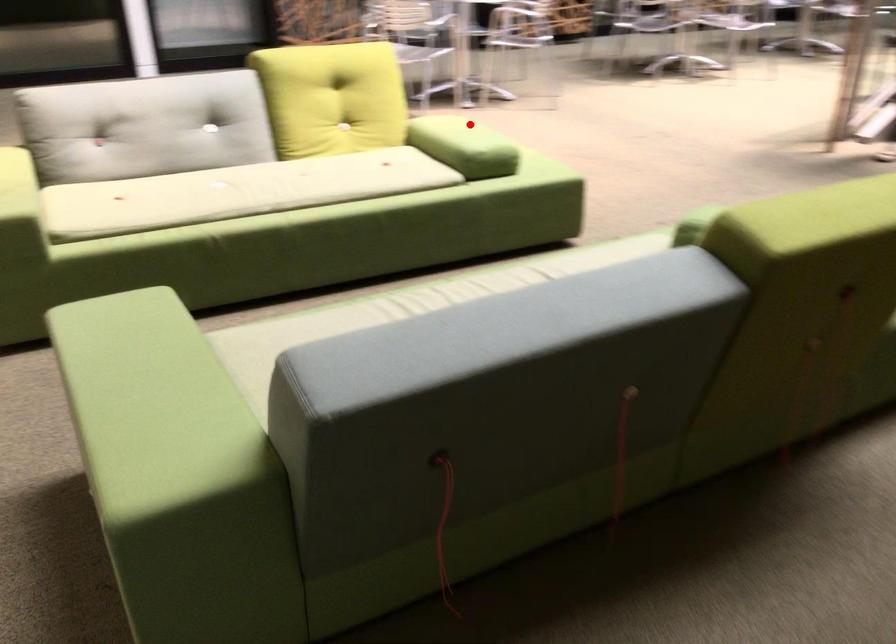
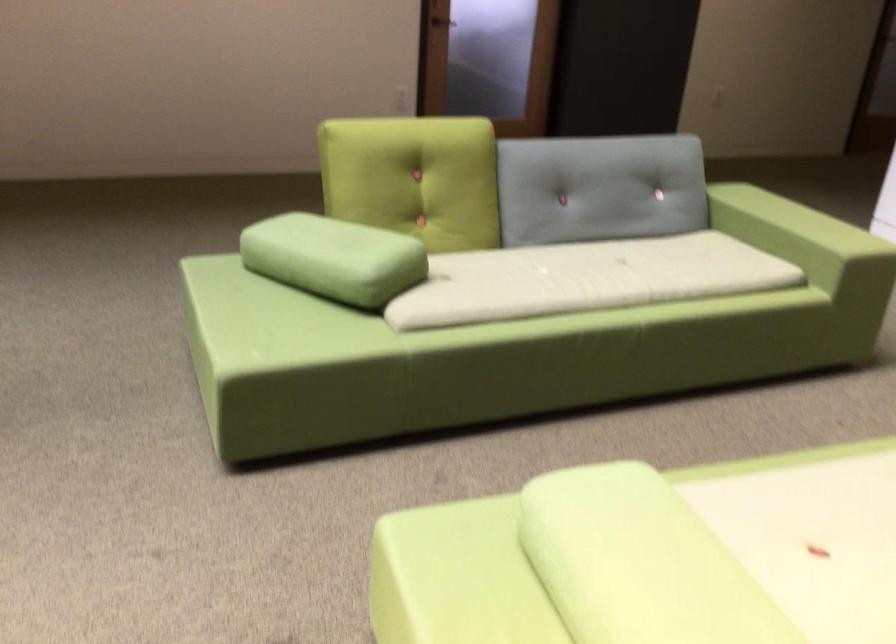
The point at the highlighted location is marked in the first image. Where is the corresponding point in the second image?

(639, 563)